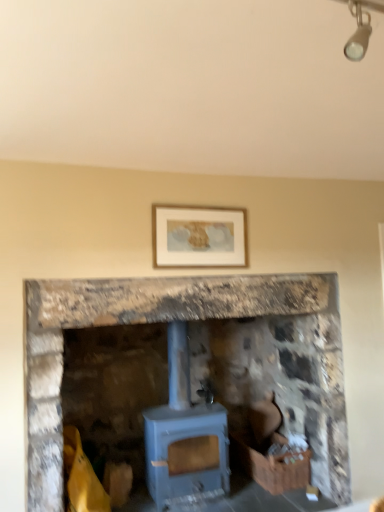
Question: Is blue matte wood burning stove at center to the left of wooden crate at lower right from the viewer's perspective?

Choices:
 (A) yes
 (B) no

Answer: (A)

Question: Can you confirm if blue matte wood burning stove at center is wider than wooden crate at lower right?

Choices:
 (A) yes
 (B) no

Answer: (A)

Question: Could you tell me if blue matte wood burning stove at center is turned towards wooden crate at lower right?

Choices:
 (A) yes
 (B) no

Answer: (B)

Question: Is wooden crate at lower right located within blue matte wood burning stove at center?

Choices:
 (A) no
 (B) yes

Answer: (A)

Question: From the image's perspective, is blue matte wood burning stove at center located above wooden crate at lower right?

Choices:
 (A) yes
 (B) no

Answer: (A)

Question: Is blue matte wood burning stove at center taller or shorter than blue stone fireplace at center?

Choices:
 (A) short
 (B) tall

Answer: (A)

Question: Would you say blue matte wood burning stove at center is inside or outside blue stone fireplace at center?

Choices:
 (A) inside
 (B) outside

Answer: (A)

Question: Is point (213, 475) positioned closer to the camera than point (271, 327)?

Choices:
 (A) closer
 (B) farther

Answer: (A)

Question: From the image's perspective, is blue matte wood burning stove at center positioned above or below blue stone fireplace at center?

Choices:
 (A) above
 (B) below

Answer: (B)

Question: Is wooden crate at lower right wider or thinner than blue stone fireplace at center?

Choices:
 (A) thin
 (B) wide

Answer: (A)

Question: Considering the positions of wooden crate at lower right and blue stone fireplace at center in the image, is wooden crate at lower right taller or shorter than blue stone fireplace at center?

Choices:
 (A) tall
 (B) short

Answer: (B)

Question: Does point (269, 485) appear closer or farther from the camera than point (39, 326)?

Choices:
 (A) closer
 (B) farther

Answer: (B)

Question: Based on their positions, is wooden crate at lower right located to the left or right of blue stone fireplace at center?

Choices:
 (A) right
 (B) left

Answer: (A)

Question: Choose the correct answer: Is blue stone fireplace at center inside blue matte wood burning stove at center or outside it?

Choices:
 (A) inside
 (B) outside

Answer: (B)

Question: Considering the positions of blue stone fireplace at center and blue matte wood burning stove at center in the image, is blue stone fireplace at center wider or thinner than blue matte wood burning stove at center?

Choices:
 (A) thin
 (B) wide

Answer: (B)